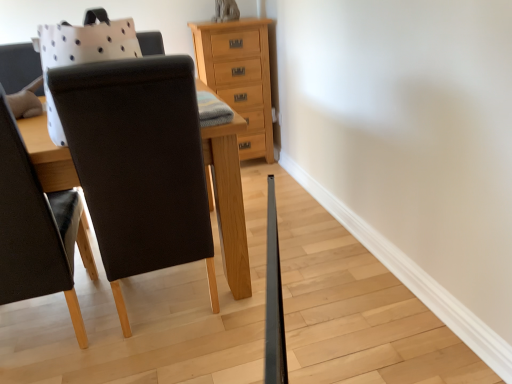
Question: From a real-world perspective, is matte black chair at left on wooden table at center?

Choices:
 (A) no
 (B) yes

Answer: (A)

Question: Could wooden table at center be considered to be inside matte black chair at left?

Choices:
 (A) no
 (B) yes

Answer: (A)

Question: Can you confirm if matte black chair at left is smaller than wooden table at center?

Choices:
 (A) no
 (B) yes

Answer: (B)

Question: From the image's perspective, is matte black chair at left on wooden table at center?

Choices:
 (A) yes
 (B) no

Answer: (B)

Question: Is matte black chair at left taller than wooden table at center?

Choices:
 (A) yes
 (B) no

Answer: (B)

Question: Looking at the image, does wooden table at center seem bigger or smaller compared to matte black chair at left?

Choices:
 (A) small
 (B) big

Answer: (B)

Question: Visually, is wooden table at center positioned to the left or to the right of matte black chair at left?

Choices:
 (A) left
 (B) right

Answer: (B)

Question: Is wooden table at center wider or thinner than matte black chair at left?

Choices:
 (A) wide
 (B) thin

Answer: (A)

Question: From the image's perspective, is wooden table at center above or below matte black chair at left?

Choices:
 (A) above
 (B) below

Answer: (A)

Question: In terms of height, does matte black chair at left look taller or shorter compared to wooden table at center?

Choices:
 (A) short
 (B) tall

Answer: (A)

Question: In terms of width, does matte black chair at left look wider or thinner when compared to wooden table at center?

Choices:
 (A) thin
 (B) wide

Answer: (A)

Question: From a real-world perspective, is matte black chair at left physically located above or below wooden table at center?

Choices:
 (A) below
 (B) above

Answer: (A)

Question: Is matte black chair at left situated inside wooden table at center or outside?

Choices:
 (A) outside
 (B) inside

Answer: (A)

Question: Would you say matte black chair at left is inside or outside natural wood chest of drawers at upper center?

Choices:
 (A) outside
 (B) inside

Answer: (A)

Question: Considering their positions, is matte black chair at left located in front of or behind natural wood chest of drawers at upper center?

Choices:
 (A) front
 (B) behind

Answer: (A)